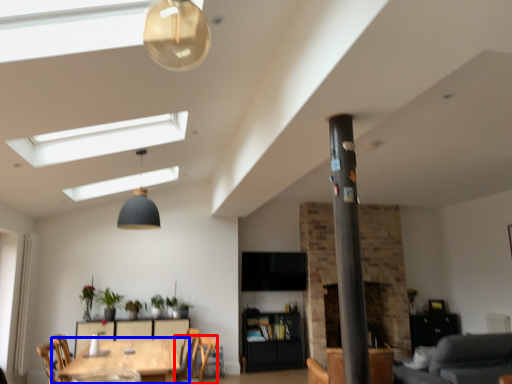
Question: Which object is further to the camera taking this photo, chair (highlighted by a red box) or table (highlighted by a blue box)?

Choices:
 (A) chair
 (B) table

Answer: (A)